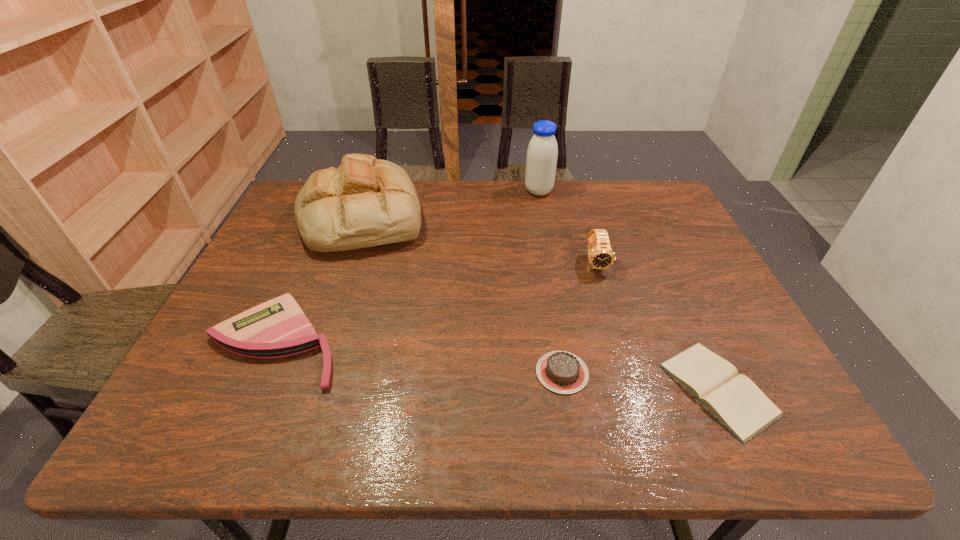
At what (x,y) coordinates should I click in order to perform the action: click on object that is the fifth closest one to the fifth tallest object. Please return your answer as a coordinate pair (x, y). The image size is (960, 540). Looking at the image, I should click on (542, 153).

In order to click on free space that satisfies the following two spatial constraints: 1. on the back side of the fifth shortest object; 2. on the right side of the third shortest object in this screenshot , I will do [330, 218].